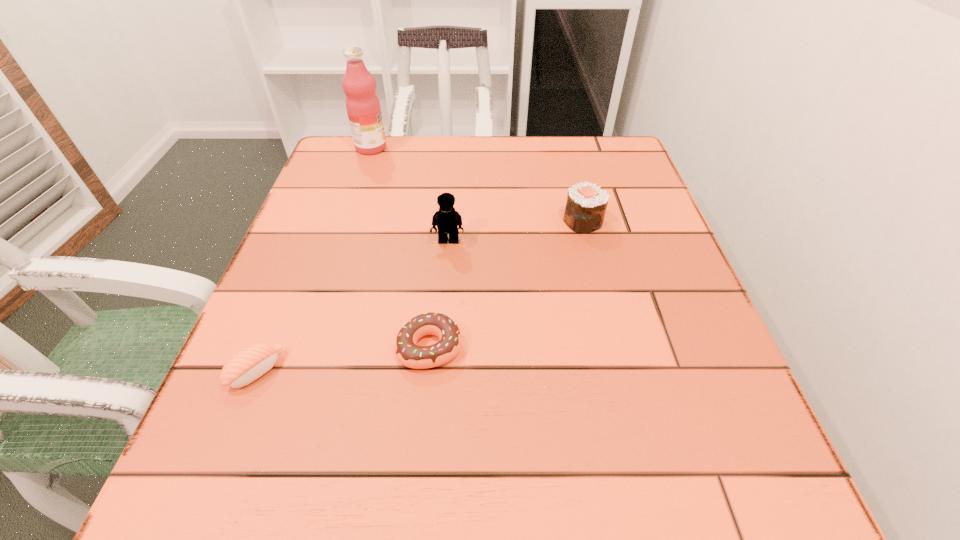
Locate an element on the screen. The width and height of the screenshot is (960, 540). vacant space that satisfies the following two spatial constraints: 1. on the back side of the nearer sushi; 2. on the left side of the rightmost object is located at coordinates click(317, 221).